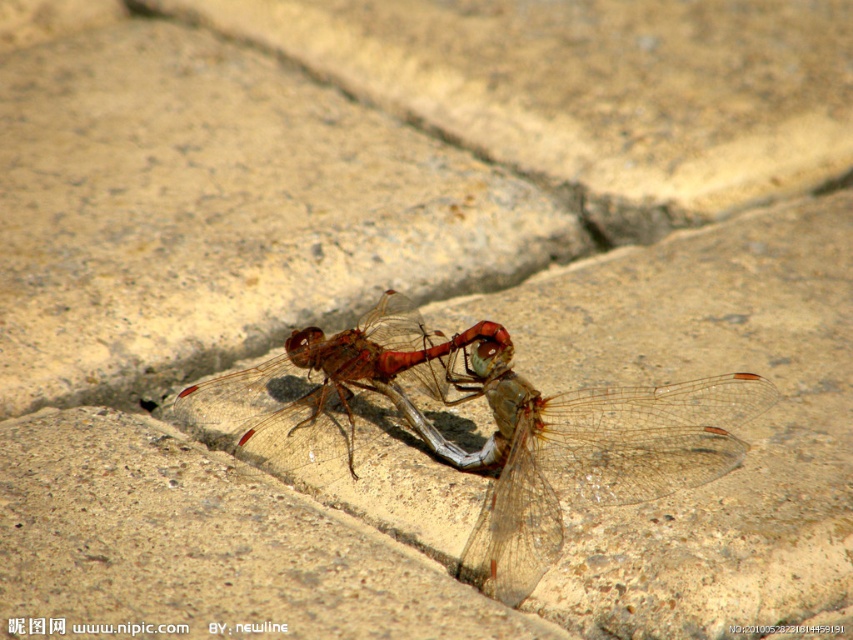
Is point (486, 518) in front of point (329, 390)?

Yes, point (486, 518) is in front of point (329, 390).

Is point (694, 401) farther from camera compared to point (369, 346)?

That is False.

Find the location of a particular element. The height and width of the screenshot is (640, 853). translucent winged insect at center is located at coordinates (587, 456).